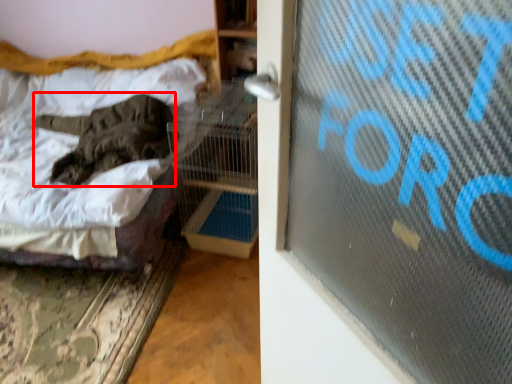
Question: Where is animal (annotated by the red box) located in relation to bed in the image?

Choices:
 (A) right
 (B) left

Answer: (A)